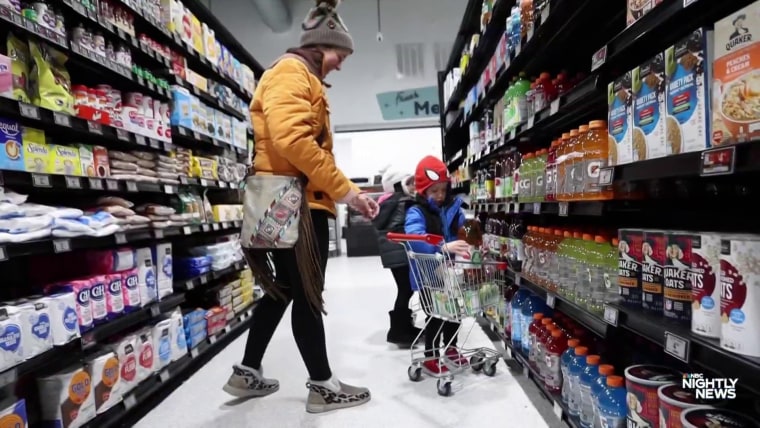
This screenshot has width=760, height=428. In order to click on floor in this screenshot , I will do `click(388, 411)`.